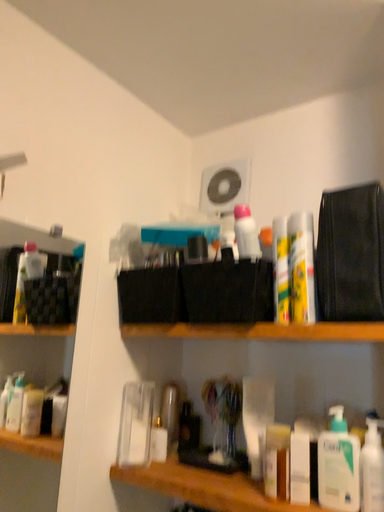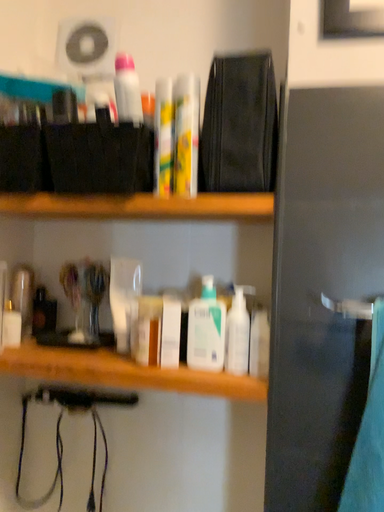
Question: Which way did the camera rotate in the video?

Choices:
 (A) rotated left
 (B) rotated right

Answer: (B)